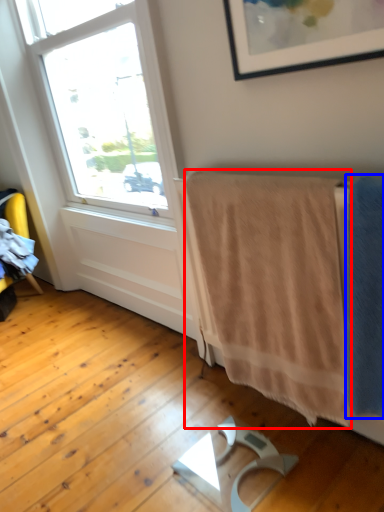
Question: Which of the following is the closest to the observer, bath towel (highlighted by a red box) or bath towel (highlighted by a blue box)?

Choices:
 (A) bath towel
 (B) bath towel

Answer: (B)